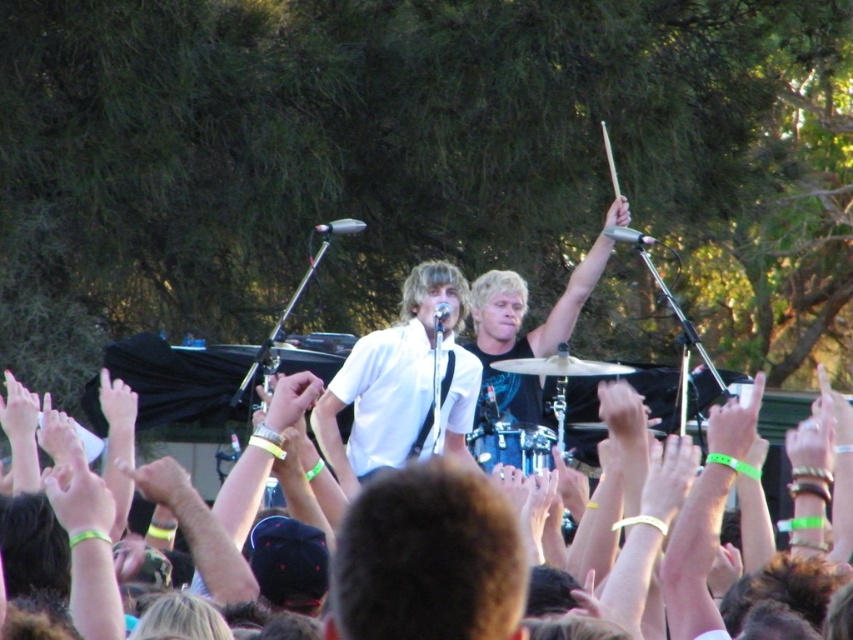
Question: Among these points, which one is nearest to the camera?

Choices:
 (A) (132, 420)
 (B) (616, 218)

Answer: (A)

Question: Can you confirm if smooth skin hand at center is positioned to the right of green rubber bracelet at upper center?

Choices:
 (A) no
 (B) yes

Answer: (A)

Question: Is white matte hand at center to the left of light skin tone flesh at raised from the viewer's perspective?

Choices:
 (A) no
 (B) yes

Answer: (A)

Question: Which point appears farthest from the camera in this image?

Choices:
 (A) (144, 490)
 (B) (729, 432)
 (C) (461, 365)
 (D) (13, 406)

Answer: (C)

Question: Does green rubber bracelet at upper center have a greater width compared to green matte hand at upper center?

Choices:
 (A) no
 (B) yes

Answer: (A)

Question: Which point is closer to the camera?

Choices:
 (A) light brown leather hand at center
 (B) green rubber bracelet at upper center
 (C) light skin tone flesh at raised
 (D) pink rubber band at upper right

Answer: (A)